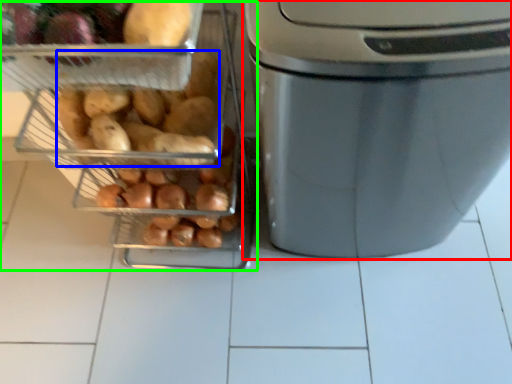
Question: Which object is the farthest from home appliance (highlighted by a red box)? Choose among these: sweet potato (highlighted by a blue box) or appliance (highlighted by a green box).

Choices:
 (A) sweet potato
 (B) appliance

Answer: (A)